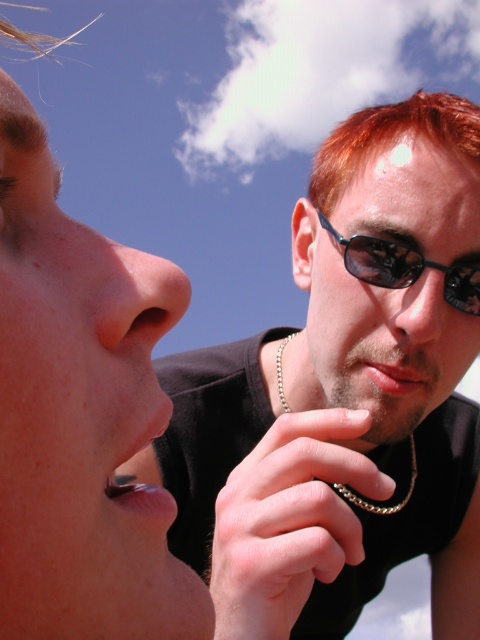
Question: Is the position of reddish hair at upper right less distant than that of black plastic sunglasses at upper right?

Choices:
 (A) no
 (B) yes

Answer: (A)

Question: From the image, what is the correct spatial relationship of smooth skin hand at center in relation to matte black nose at center?

Choices:
 (A) left
 (B) right

Answer: (A)

Question: Which of the following is the closest to the observer?

Choices:
 (A) (419, 448)
 (B) (182, 296)
 (C) (312, 180)
 (D) (299, 524)

Answer: (B)

Question: Is matte flesh-colored nose at center bigger than gold chain at center?

Choices:
 (A) yes
 (B) no

Answer: (B)

Question: Which of these objects is positioned farthest from the black plastic sunglasses at upper right?

Choices:
 (A) gold chain at center
 (B) reddish hair at upper right

Answer: (A)

Question: Which of the following is the farthest from the observer?

Choices:
 (A) (392, 120)
 (B) (350, 246)
 (C) (403, 285)

Answer: (A)